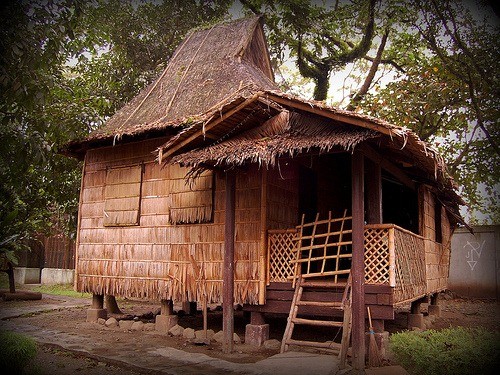
Locate an element on the screen. Image resolution: width=500 pixels, height=375 pixels. window spaces on house is located at coordinates (117, 199), (190, 188).